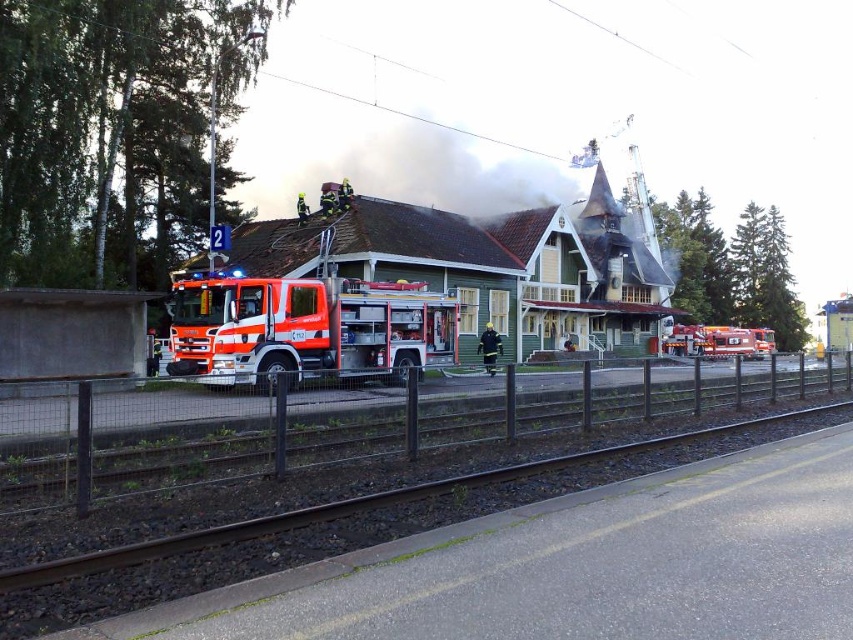
Question: Is green wooden railway station at center below black uniform fireman at center?

Choices:
 (A) no
 (B) yes

Answer: (A)

Question: Which point appears farthest from the camera in this image?

Choices:
 (A) (479, 312)
 (B) (753, 342)

Answer: (B)

Question: Is metal fence at lower center below orange glossy fire truck at center?

Choices:
 (A) no
 (B) yes

Answer: (B)

Question: Can you confirm if orange glossy fire truck at center is bigger than black uniform fireman at center?

Choices:
 (A) no
 (B) yes

Answer: (B)

Question: Estimate the real-world distances between objects in this image. Which object is farther from the green wooden railway station at center?

Choices:
 (A) orange glossy fire truck at center
 (B) orange reflective fire truck at center
 (C) black uniform fireman at center
 (D) metal fence at lower center

Answer: (D)

Question: Among these points, which one is farthest from the camera?

Choices:
 (A) (712, 356)
 (B) (408, 284)
 (C) (242, 248)
 (D) (50, 470)

Answer: (A)